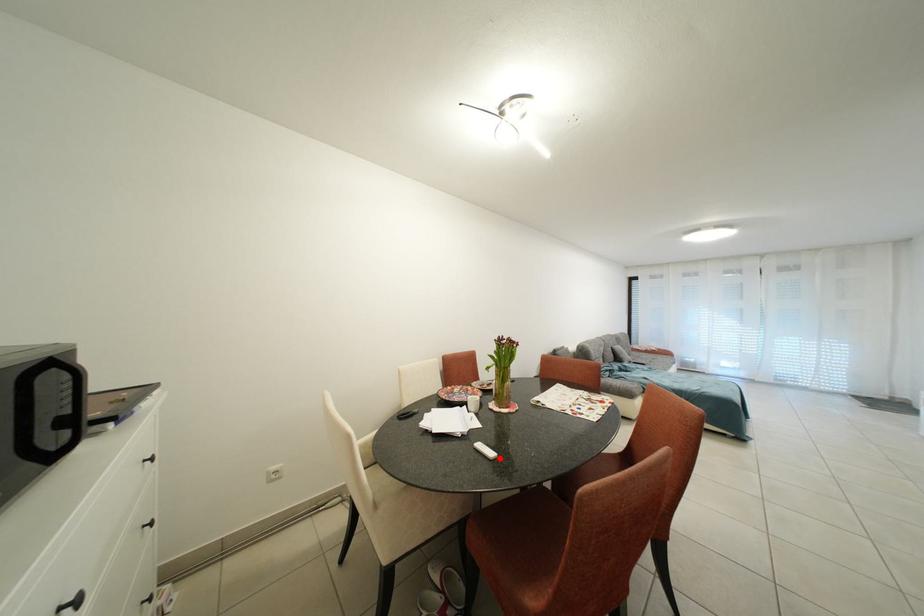
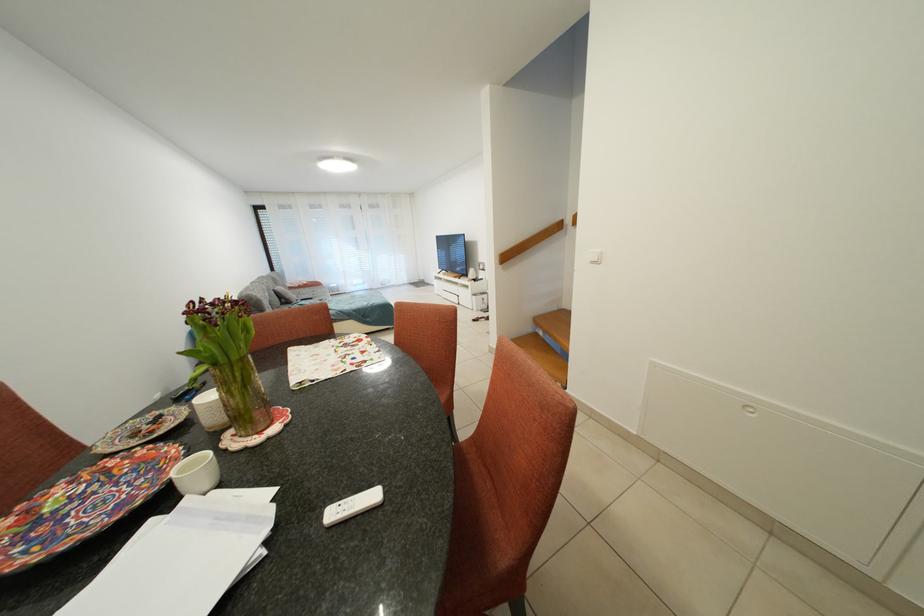
Question: I am providing you with two images of the same scene from different viewpoints. A red point is shown in image1. For the corresponding object point in image2, is it positioned nearer or farther from the camera?

Choices:
 (A) Nearer
 (B) Farther

Answer: (B)